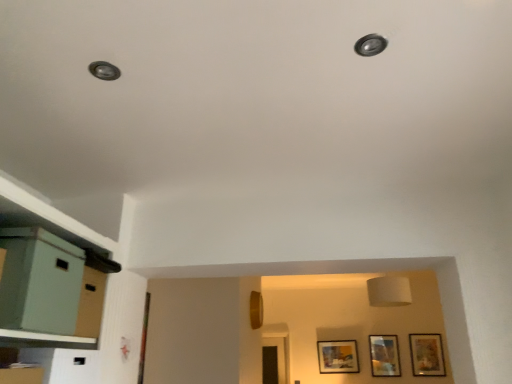
Question: Considering the relative sizes of matte gold picture frame at lower right, the first picture frame in the right-to-left sequence, and matte wooden picture frame at center, which appears as the third picture frame when viewed from the right, in the image provided, is matte gold picture frame at lower right, the first picture frame in the right-to-left sequence, thinner than matte wooden picture frame at center, which appears as the third picture frame when viewed from the right,?

Choices:
 (A) no
 (B) yes

Answer: (B)

Question: Is matte gold picture frame at lower right, acting as the 3th picture frame starting from the left, aimed at matte wooden picture frame at center, marked as the 1th picture frame in a left-to-right arrangement?

Choices:
 (A) no
 (B) yes

Answer: (A)

Question: Does matte gold picture frame at lower right, the first picture frame in the right-to-left sequence, come behind matte wooden picture frame at center, which appears as the third picture frame when viewed from the right?

Choices:
 (A) no
 (B) yes

Answer: (A)

Question: Is matte gold picture frame at lower right, acting as the 3th picture frame starting from the left, taller than matte wooden picture frame at center, marked as the 1th picture frame in a left-to-right arrangement?

Choices:
 (A) yes
 (B) no

Answer: (A)

Question: From the image's perspective, is matte gold picture frame at lower right, the first picture frame in the right-to-left sequence, above matte wooden picture frame at center, which appears as the third picture frame when viewed from the right?

Choices:
 (A) yes
 (B) no

Answer: (A)

Question: Is matte gold picture frame at lower right, acting as the 3th picture frame starting from the left, wider than matte wooden picture frame at center, marked as the 1th picture frame in a left-to-right arrangement?

Choices:
 (A) yes
 (B) no

Answer: (B)

Question: Considering the relative sizes of matte green file cabinet at left and wooden picture frame at lower right, the 2th picture frame in the right-to-left sequence, in the image provided, is matte green file cabinet at left wider than wooden picture frame at lower right, the 2th picture frame in the right-to-left sequence,?

Choices:
 (A) yes
 (B) no

Answer: (A)

Question: Is matte green file cabinet at left to the left of wooden picture frame at lower right, the 2th picture frame in the right-to-left sequence, from the viewer's perspective?

Choices:
 (A) yes
 (B) no

Answer: (A)

Question: From the image's perspective, is matte green file cabinet at left located beneath wooden picture frame at lower right, the 2th picture frame in the right-to-left sequence?

Choices:
 (A) no
 (B) yes

Answer: (A)

Question: Does matte green file cabinet at left turn towards wooden picture frame at lower right, the second picture frame in the left-to-right sequence?

Choices:
 (A) no
 (B) yes

Answer: (A)

Question: Is matte green file cabinet at left touching wooden picture frame at lower right, the 2th picture frame in the right-to-left sequence?

Choices:
 (A) yes
 (B) no

Answer: (B)

Question: Is matte green file cabinet at left located outside wooden picture frame at lower right, the second picture frame in the left-to-right sequence?

Choices:
 (A) no
 (B) yes

Answer: (B)

Question: Is matte gold picture frame at lower right, the first picture frame in the right-to-left sequence, facing towards wooden picture frame at lower right, the 2th picture frame in the right-to-left sequence?

Choices:
 (A) yes
 (B) no

Answer: (B)